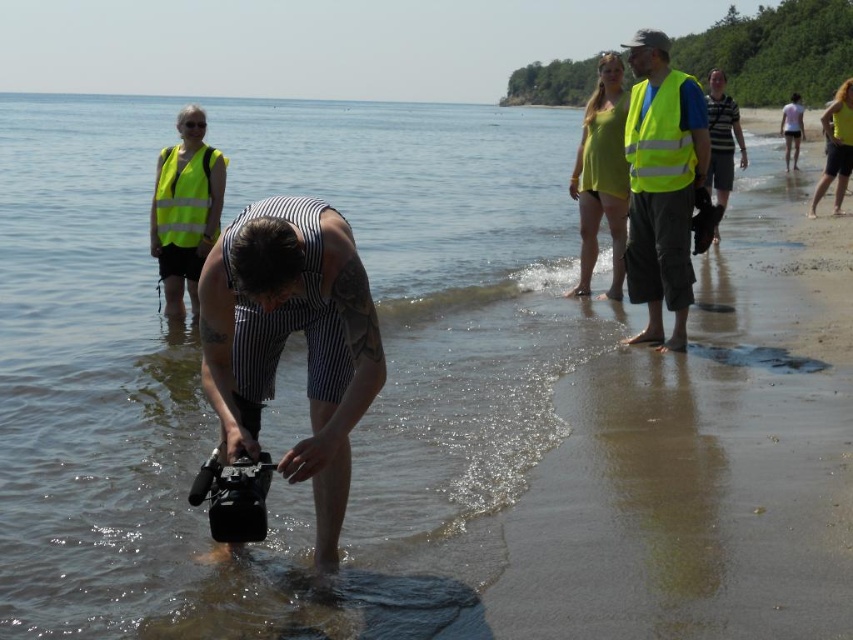
Is yellow matte dress at upper right in front of striped fabric shirt at center?

No, it is behind striped fabric shirt at center.

Is point (619, 86) closer to camera compared to point (717, 144)?

Yes, it is in front of point (717, 144).

The width and height of the screenshot is (853, 640). I want to click on yellow matte dress at upper right, so point(602,173).

Between high visibility vest at upper left and yellow reflective vest at upper center, which one is positioned higher?

Positioned higher is yellow reflective vest at upper center.

Does high visibility vest at upper left appear under yellow reflective vest at upper center?

Yes.

Who is more forward, (x=209, y=232) or (x=668, y=134)?

Point (x=668, y=134) is more forward.

The image size is (853, 640). I want to click on high visibility vest at upper left, so click(184, 209).

Who is more forward, [178,177] or [718,125]?

Point [178,177] is in front.

Is yellow reflective vest at upper left smaller than striped fabric shirt at center?

Correct, yellow reflective vest at upper left occupies less space than striped fabric shirt at center.

The height and width of the screenshot is (640, 853). What do you see at coordinates (183, 195) in the screenshot?
I see `yellow reflective vest at upper left` at bounding box center [183, 195].

Locate an element on the screen. The image size is (853, 640). yellow reflective vest at upper left is located at coordinates click(183, 195).